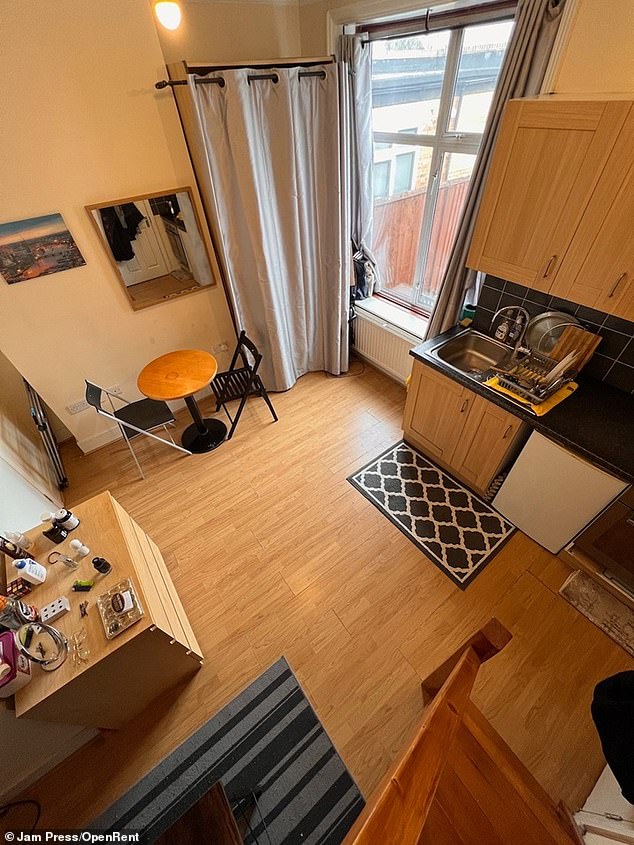
This screenshot has width=634, height=845. I want to click on dresser, so click(122, 564).